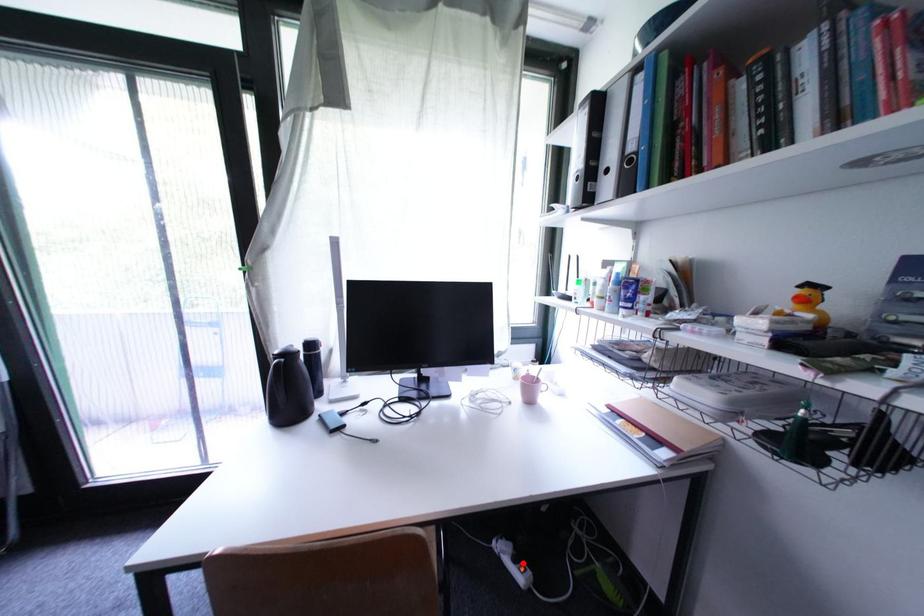
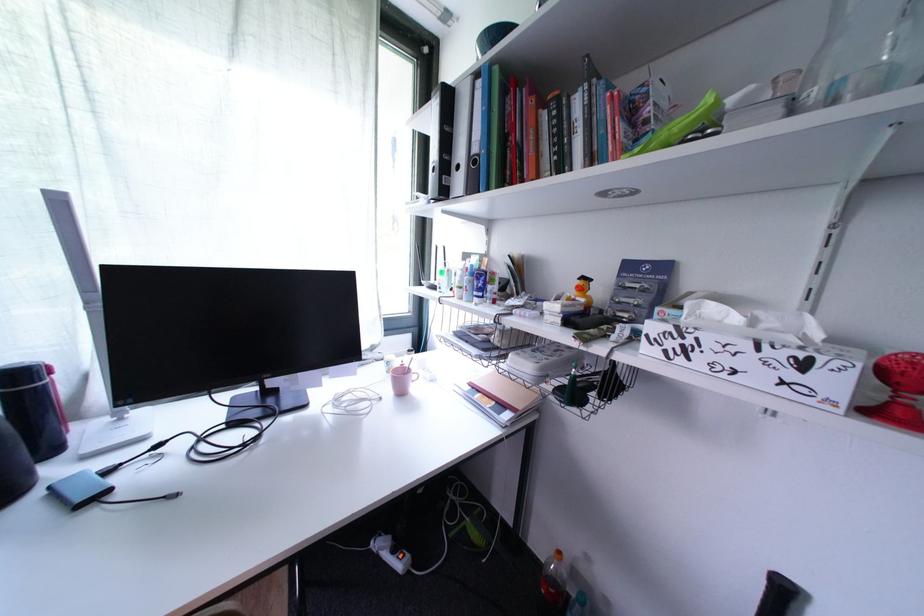
Where in the second image is the point corresponding to the highlighted location from the first image?

(402, 553)